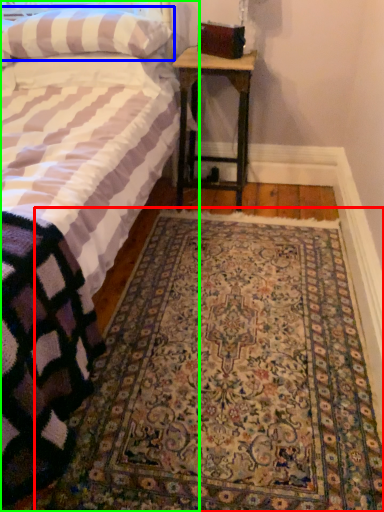
Question: Estimate the real-world distances between objects in this image. Which object is closer to mat (highlighted by a red box), pillow (highlighted by a blue box) or bed (highlighted by a green box)?

Choices:
 (A) pillow
 (B) bed

Answer: (B)